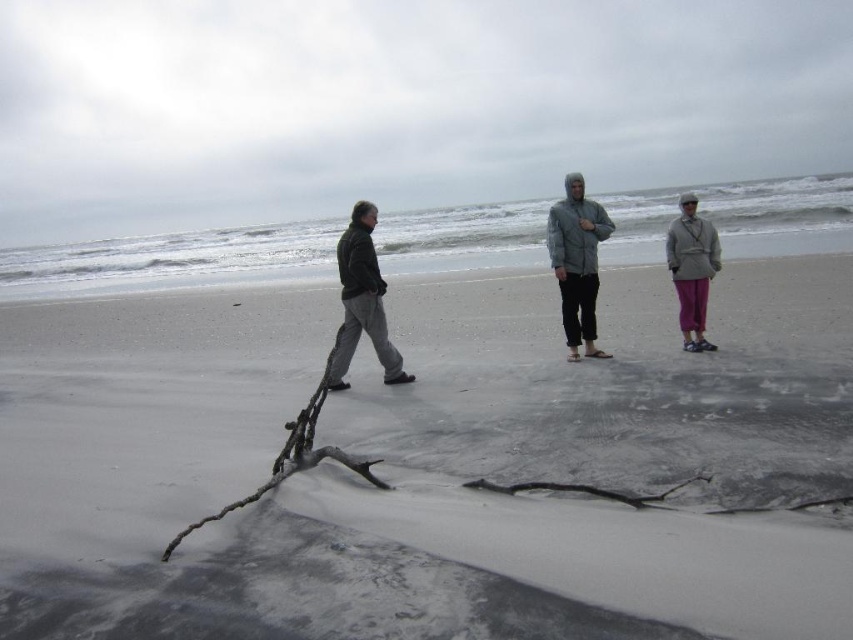
Question: Is gray woolen jacket at center below gray soft jacket at center?

Choices:
 (A) yes
 (B) no

Answer: (A)

Question: Which point is farther to the camera?

Choices:
 (A) gray sand at center
 (B) gray soft jacket at center
 (C) matte gray coat at center right
 (D) gray fabric jacket at center

Answer: (D)

Question: Which object is farther from the camera taking this photo?

Choices:
 (A) gray woolen jacket at center
 (B) matte gray coat at center right

Answer: (B)

Question: Is gray sand at center to the left of gray fabric jacket at center from the viewer's perspective?

Choices:
 (A) yes
 (B) no

Answer: (A)

Question: Which object appears closest to the camera in this image?

Choices:
 (A) dark gray fabric jacket at left
 (B) gray sand at center

Answer: (B)

Question: Is gray woolen jacket at center positioned before matte gray coat at center right?

Choices:
 (A) yes
 (B) no

Answer: (A)